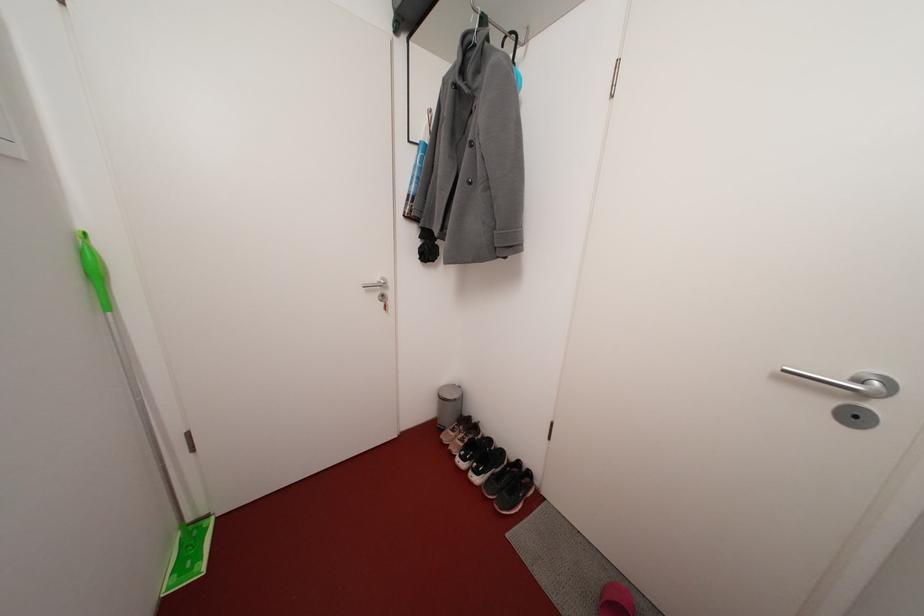
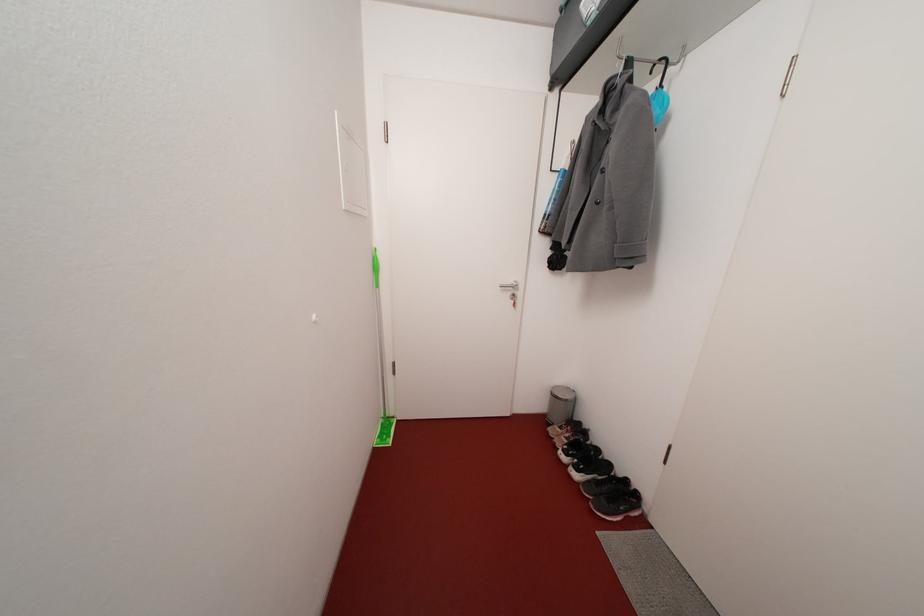
Find the pixel in the second image that matches (383,285) in the first image.

(517, 286)